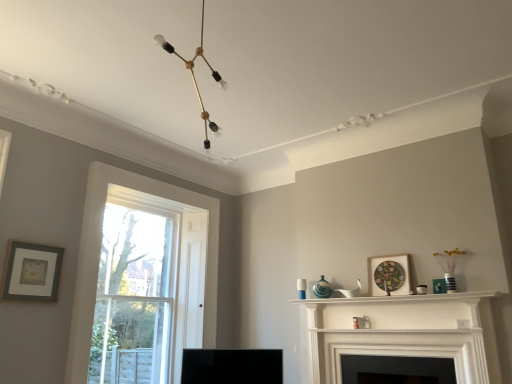
Question: Is white matte fireplace at center, which is the 1th fireplace from top to bottom, positioned behind black matte fireplace at center, the second fireplace when ordered from top to bottom?

Choices:
 (A) no
 (B) yes

Answer: (A)

Question: From a real-world perspective, is white matte fireplace at center, which is the 1th fireplace from top to bottom, positioned over black matte fireplace at center, the second fireplace when ordered from top to bottom, based on gravity?

Choices:
 (A) yes
 (B) no

Answer: (A)

Question: Is black matte fireplace at center, the second fireplace when ordered from top to bottom, located within white matte fireplace at center, which is the 1th fireplace from top to bottom?

Choices:
 (A) yes
 (B) no

Answer: (B)

Question: Does white matte fireplace at center, the 2th fireplace in the bottom-to-top sequence, have a greater width compared to black matte fireplace at center, the second fireplace when ordered from top to bottom?

Choices:
 (A) yes
 (B) no

Answer: (B)

Question: Is white matte fireplace at center, which is the 1th fireplace from top to bottom, facing away from black matte fireplace at center, the second fireplace when ordered from top to bottom?

Choices:
 (A) no
 (B) yes

Answer: (B)

Question: Is point (202, 119) positioned closer to the camera than point (40, 246)?

Choices:
 (A) closer
 (B) farther

Answer: (B)

Question: Is gold metallic chandelier at upper center spatially inside matte gray picture frame at left, the 2th picture frame when ordered from right to left, or outside of it?

Choices:
 (A) inside
 (B) outside

Answer: (B)

Question: Visually, is gold metallic chandelier at upper center positioned to the left or to the right of matte gray picture frame at left, the 2th picture frame when ordered from right to left?

Choices:
 (A) left
 (B) right

Answer: (B)

Question: Looking at their shapes, would you say gold metallic chandelier at upper center is wider or thinner than matte gray picture frame at left, the 2th picture frame when ordered from right to left?

Choices:
 (A) thin
 (B) wide

Answer: (B)

Question: Considering the positions of matte gray picture frame at left, arranged as the 1th picture frame when viewed from the left, and black matte fireplace at center, the first fireplace when ordered from bottom to top, in the image, is matte gray picture frame at left, arranged as the 1th picture frame when viewed from the left, wider or thinner than black matte fireplace at center, the first fireplace when ordered from bottom to top,?

Choices:
 (A) wide
 (B) thin

Answer: (B)

Question: Considering the positions of matte gray picture frame at left, arranged as the 1th picture frame when viewed from the left, and black matte fireplace at center, the first fireplace when ordered from bottom to top, in the image, is matte gray picture frame at left, arranged as the 1th picture frame when viewed from the left, bigger or smaller than black matte fireplace at center, the first fireplace when ordered from bottom to top,?

Choices:
 (A) small
 (B) big

Answer: (A)

Question: From the image's perspective, is matte gray picture frame at left, the 2th picture frame when ordered from right to left, located above or below black matte fireplace at center, the second fireplace when ordered from top to bottom?

Choices:
 (A) below
 (B) above

Answer: (B)

Question: Visually, is matte gray picture frame at left, arranged as the 1th picture frame when viewed from the left, positioned to the left or to the right of black matte fireplace at center, the first fireplace when ordered from bottom to top?

Choices:
 (A) left
 (B) right

Answer: (A)

Question: Considering the positions of white matte fireplace at center, the 2th fireplace in the bottom-to-top sequence, and white glossy shelf at upper center in the image, is white matte fireplace at center, the 2th fireplace in the bottom-to-top sequence, bigger or smaller than white glossy shelf at upper center?

Choices:
 (A) small
 (B) big

Answer: (B)

Question: From the image's perspective, is white matte fireplace at center, the 2th fireplace in the bottom-to-top sequence, positioned above or below white glossy shelf at upper center?

Choices:
 (A) above
 (B) below

Answer: (B)